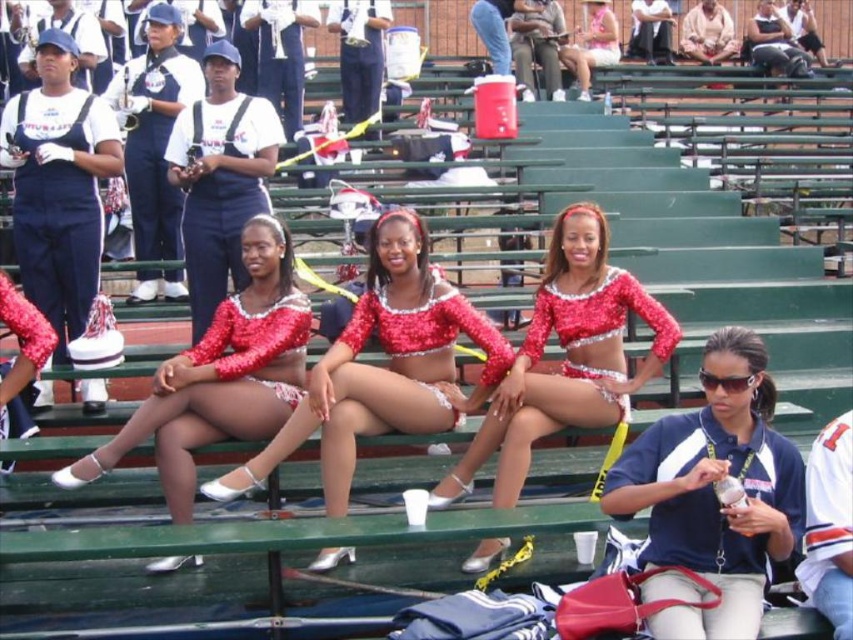
Does point (740, 451) come farther from viewer compared to point (177, 515)?

No, it is not.

This screenshot has width=853, height=640. I want to click on sunglasses at center, so click(712, 492).

From the picture: Between shiny sequined top at center and sparkly red sequin top at center, which one appears on the left side from the viewer's perspective?

Positioned to the left is shiny sequined top at center.

Between shiny sequined top at center and sparkly red sequin top at center, which one appears on the right side from the viewer's perspective?

From the viewer's perspective, sparkly red sequin top at center appears more on the right side.

Between point (343, 440) and point (252, 381), which one is positioned in front?

Point (343, 440)

You are a GUI agent. You are given a task and a screenshot of the screen. Output one action in this format:
    pyautogui.click(x=<x>, y=<y>)
    Task: Click on the shiny sequined top at center
    
    Given the screenshot: What is the action you would take?
    pyautogui.click(x=381, y=368)

Between sunglasses at center and shiny sequined top at center, which one has more height?

With more height is sunglasses at center.

Which is above, sunglasses at center or shiny sequined top at center?

sunglasses at center is higher up.

The width and height of the screenshot is (853, 640). I want to click on sunglasses at center, so click(x=712, y=492).

Identify the location of sunglasses at center. (712, 492).